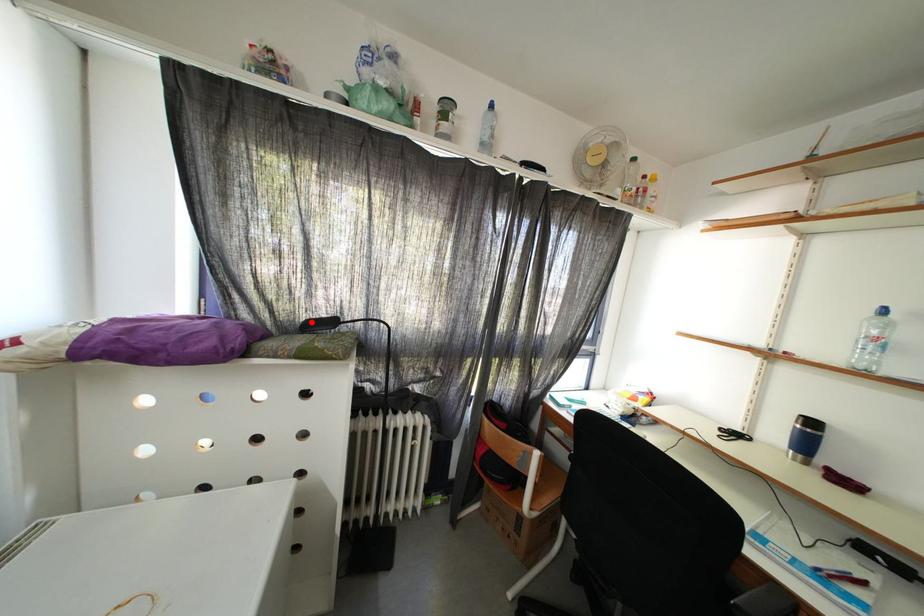
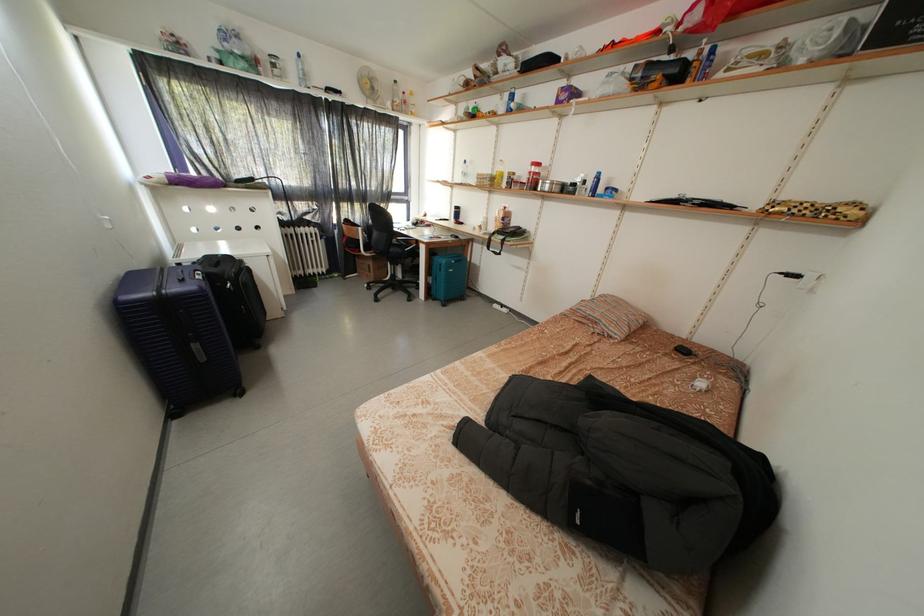
Question: I am providing you with two images of the same scene from different viewpoints. A red point is marked on the first image. Can you still see the location of the red point in image 2?

Choices:
 (A) Yes
 (B) No

Answer: (A)